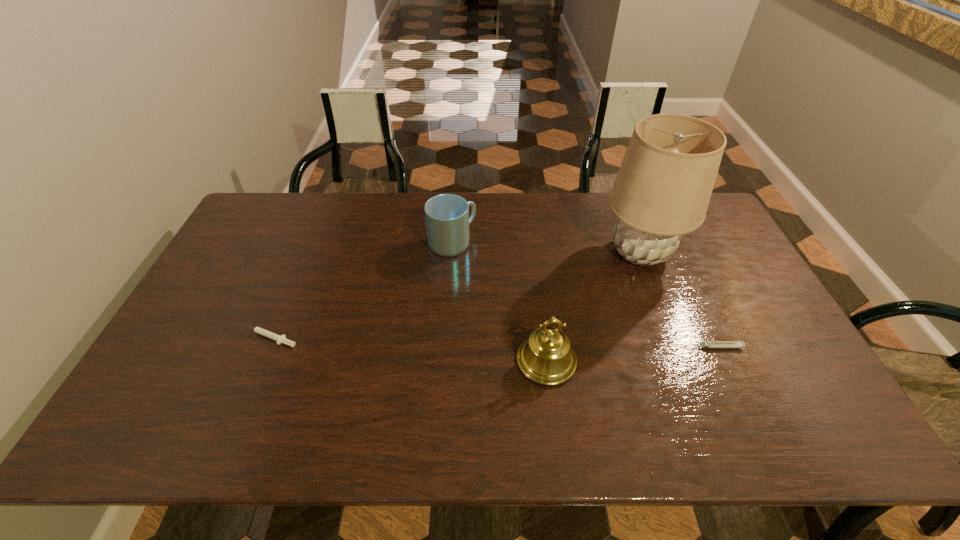
Find the location of a particular element. The image size is (960, 540). lampshade is located at coordinates (662, 190).

Locate an element on the screen. Image resolution: width=960 pixels, height=540 pixels. the third object from left to right is located at coordinates [x=546, y=357].

The image size is (960, 540). Find the location of `the fourth object from right to left`. the fourth object from right to left is located at coordinates (447, 219).

At what (x,y) coordinates should I click in order to perform the action: click on the right syringe. Please return your answer as a coordinate pair (x, y). The width and height of the screenshot is (960, 540). Looking at the image, I should click on (739, 344).

This screenshot has width=960, height=540. What are the coordinates of `the left syringe` in the screenshot? It's located at (280, 339).

Find the location of `vacant region located on the right of the tallest object`. vacant region located on the right of the tallest object is located at coordinates (710, 253).

The image size is (960, 540). Find the location of `free space located on the right of the third object from right to left`. free space located on the right of the third object from right to left is located at coordinates (724, 361).

This screenshot has width=960, height=540. I want to click on vacant space located 0.090m on the front of the fourth object from right to left, so click(449, 278).

The image size is (960, 540). Find the location of `free space located 0.140m at the needle end of the right syringe`. free space located 0.140m at the needle end of the right syringe is located at coordinates (636, 347).

Where is `free spot located at the needle end of the right syringe`? free spot located at the needle end of the right syringe is located at coordinates [659, 347].